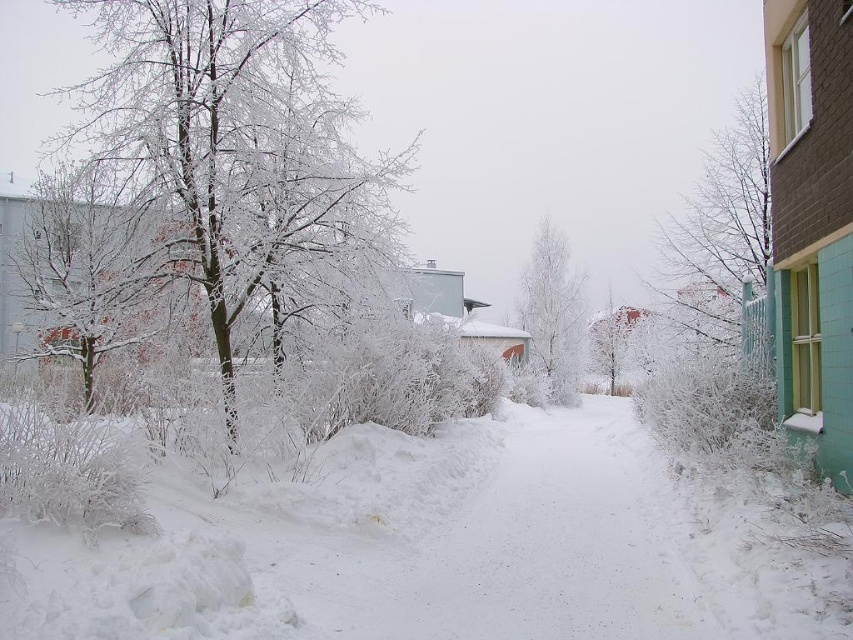
Question: Does white fluffy snow at center appear over snow-covered branches at upper right?

Choices:
 (A) no
 (B) yes

Answer: (A)

Question: Which point is closer to the camera taking this photo?

Choices:
 (A) (724, 211)
 (B) (241, 112)

Answer: (B)

Question: Is white fluffy snow at center wider than white frosty tree at center?

Choices:
 (A) no
 (B) yes

Answer: (B)

Question: Estimate the real-world distances between objects in this image. Which object is farther from the white fluffy snow at center?

Choices:
 (A) white frosty tree at center
 (B) snow-covered branches at upper right

Answer: (A)

Question: Is frosty white tree at left above snow-covered branches at upper right?

Choices:
 (A) no
 (B) yes

Answer: (A)

Question: Which point is farther from the camera taking this photo?

Choices:
 (A) (422, 506)
 (B) (321, 113)

Answer: (B)